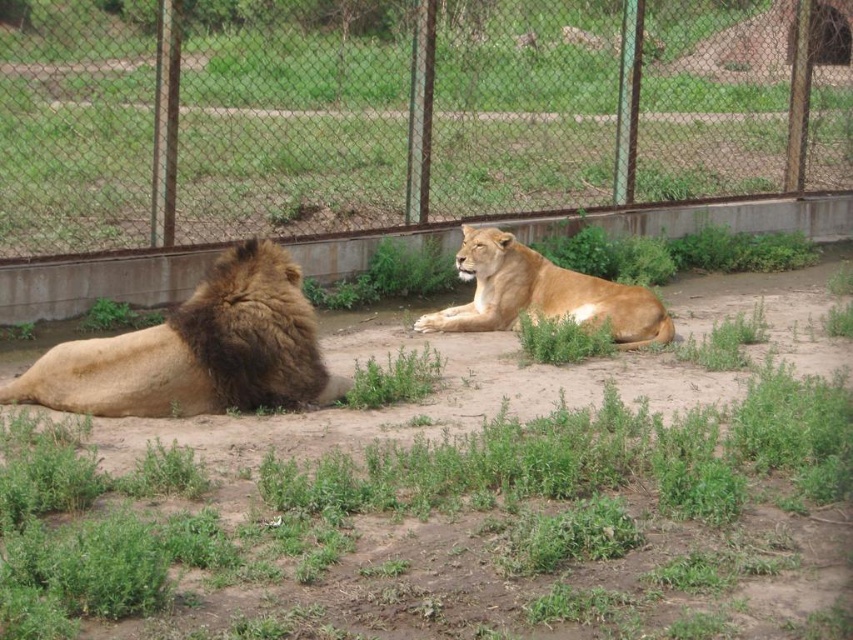
Between golden fur lion at left and golden fur lion at center, which one has less height?

golden fur lion at center

Is point (279, 256) closer to camera compared to point (570, 292)?

Yes, it is in front of point (570, 292).

Is point (28, 378) positioned before point (625, 307)?

Yes, it is in front of point (625, 307).

The height and width of the screenshot is (640, 853). I want to click on golden fur lion at left, so click(196, 349).

Can you confirm if metal mesh fence at upper center is thinner than golden fur lion at center?

Indeed, metal mesh fence at upper center has a lesser width compared to golden fur lion at center.

This screenshot has width=853, height=640. In order to click on metal mesh fence at upper center in this screenshot , I will do `click(401, 113)`.

Can you confirm if metal mesh fence at upper center is positioned to the right of golden fur lion at left?

Incorrect, metal mesh fence at upper center is not on the right side of golden fur lion at left.

Can you confirm if metal mesh fence at upper center is taller than golden fur lion at left?

In fact, metal mesh fence at upper center may be shorter than golden fur lion at left.

Between point (628, 28) and point (224, 374), which one is positioned in front?

Point (224, 374)

Locate an element on the screen. metal mesh fence at upper center is located at coordinates (401, 113).